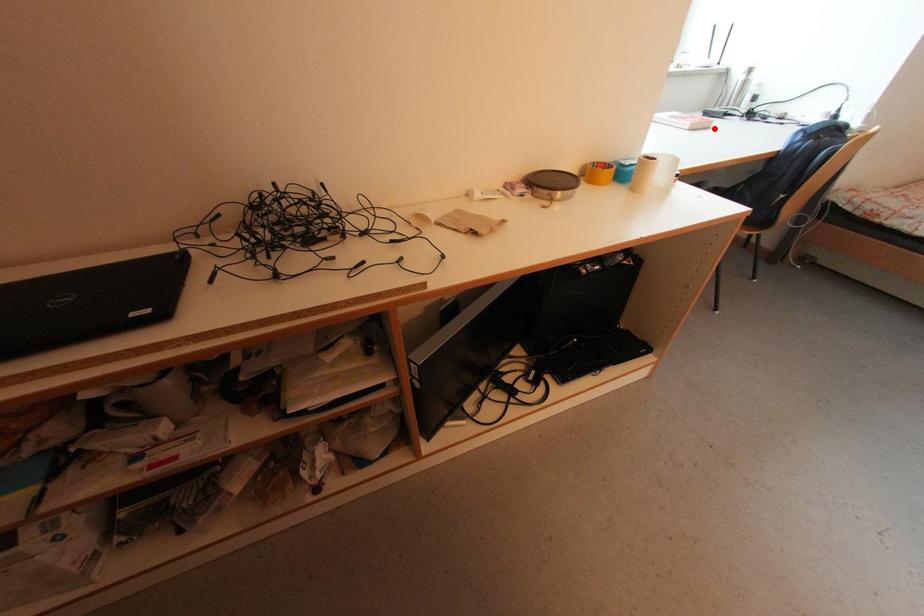
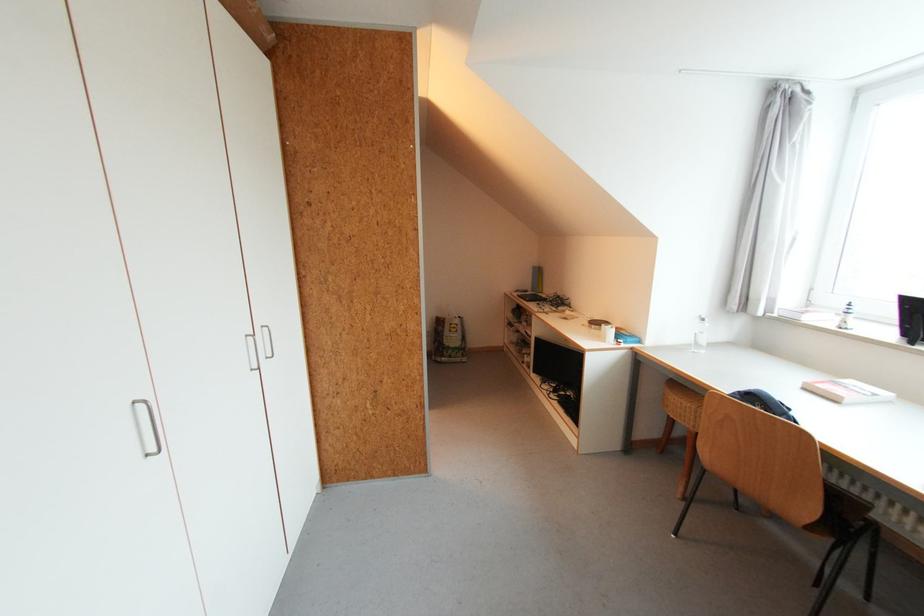
In the second image, find the point that corresponds to the highlighted location in the first image.

(841, 403)